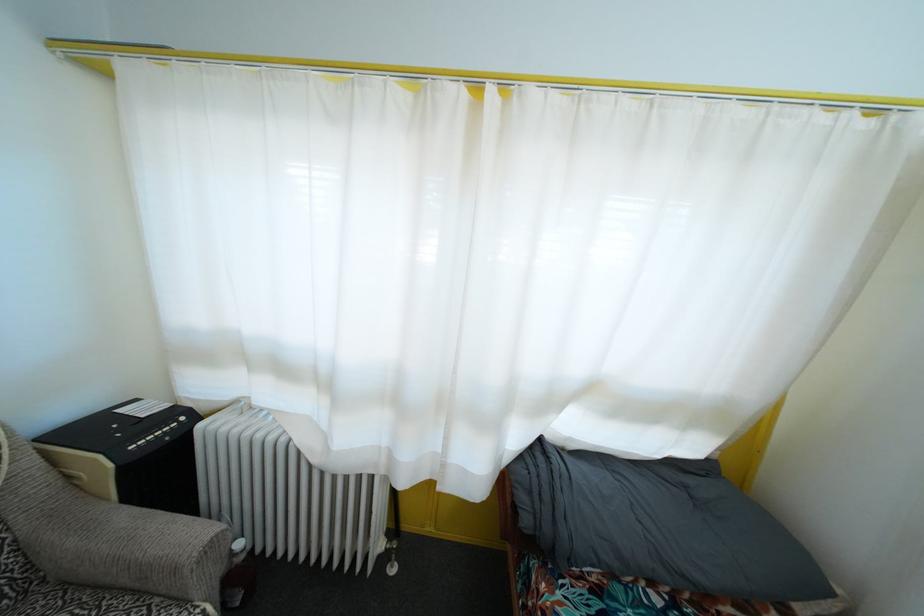
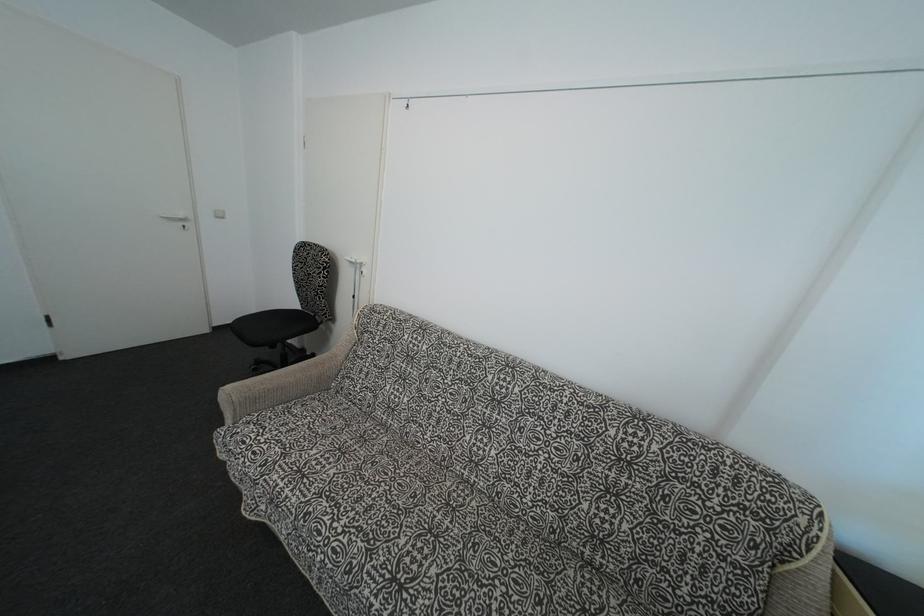
Question: The camera is either moving clockwise (left) or counter-clockwise (right) around the object. The first image is from the beginning of the video and the second image is from the end. Is the camera moving left or right when shooting the video?

Choices:
 (A) Left
 (B) Right

Answer: (B)